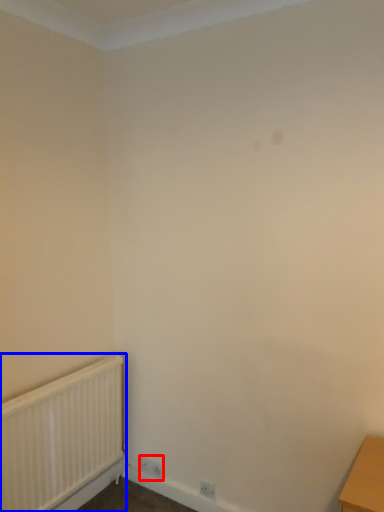
Question: Which object is closer to the camera taking this photo, electric outlet (highlighted by a red box) or radiator (highlighted by a blue box)?

Choices:
 (A) electric outlet
 (B) radiator

Answer: (B)